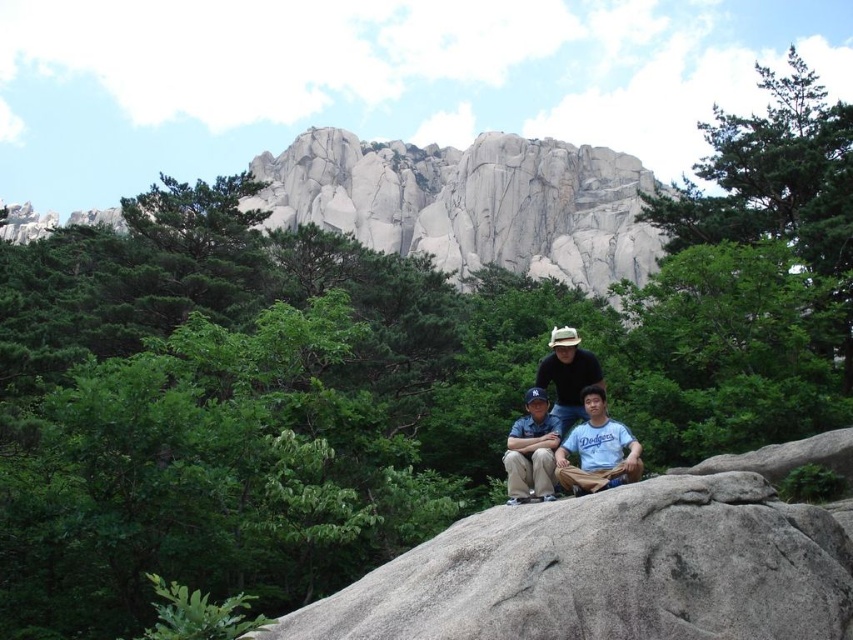
Question: Considering the real-world distances, which object is farthest from the denim shirt at center?

Choices:
 (A) gray granite boulder at center
 (B) matte brown hat at center
 (C) light blue t-shirt at center
 (D) granite rock formation at upper center

Answer: (D)

Question: Which of these objects is positioned closest to the gray granite boulder at center?

Choices:
 (A) light blue t-shirt at center
 (B) matte brown hat at center
 (C) granite rock formation at upper center
 (D) denim shirt at center

Answer: (A)

Question: Which of the following is the farthest from the observer?

Choices:
 (A) denim shirt at center
 (B) matte black shirt at center
 (C) matte brown hat at center
 (D) light blue t-shirt at center

Answer: (C)

Question: Can you confirm if matte black shirt at center is positioned below light blue t-shirt at center?

Choices:
 (A) no
 (B) yes

Answer: (A)

Question: Is gray granite boulder at center below matte black shirt at center?

Choices:
 (A) no
 (B) yes

Answer: (B)

Question: Does gray granite boulder at center have a greater width compared to matte black shirt at center?

Choices:
 (A) yes
 (B) no

Answer: (A)